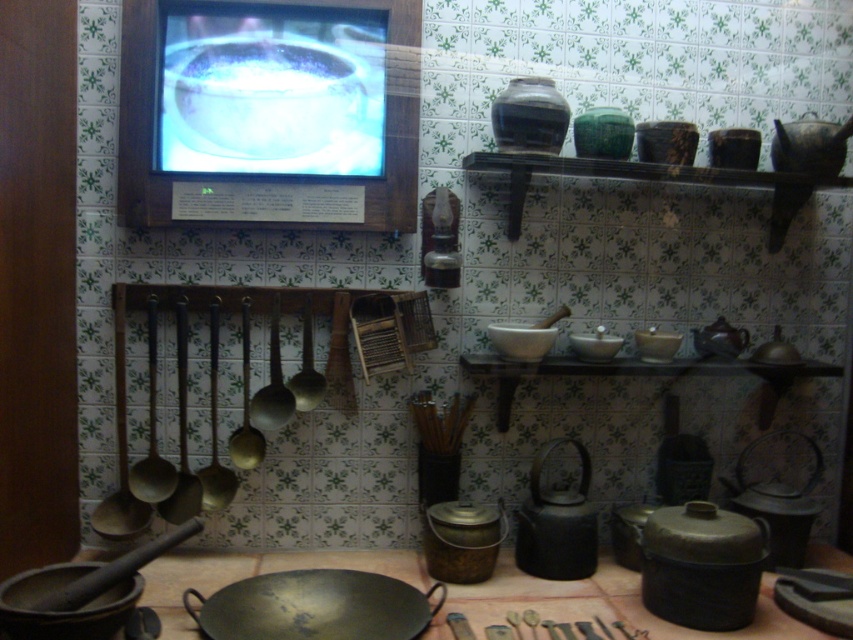
Between matte black kettle at center and matte black tea pot at lower right, which one appears on the left side from the viewer's perspective?

From the viewer's perspective, matte black kettle at center appears more on the left side.

Is the position of matte black kettle at center more distant than that of matte black tea pot at lower right?

No, it is in front of matte black tea pot at lower right.

Does point (531, 477) lie behind point (811, 483)?

No, (531, 477) is closer to viewer.

The width and height of the screenshot is (853, 640). I want to click on matte black kettle at center, so click(556, 524).

Does matte black tea pot at lower right come in front of shiny silver tea pot at center?

That is True.

Does point (788, 554) lie behind point (756, 346)?

No.

This screenshot has width=853, height=640. I want to click on matte black tea pot at lower right, so click(778, 502).

Which of these two, brass/bronze frying pan at center or brown matte tea pot at right, stands taller?

With more height is brown matte tea pot at right.

Between point (271, 580) and point (729, 355), which one is positioned in front?

Point (271, 580) is in front.

What do you see at coordinates (315, 605) in the screenshot?
I see `brass/bronze frying pan at center` at bounding box center [315, 605].

The image size is (853, 640). In order to click on brass/bronze frying pan at center in this screenshot , I will do `click(315, 605)`.